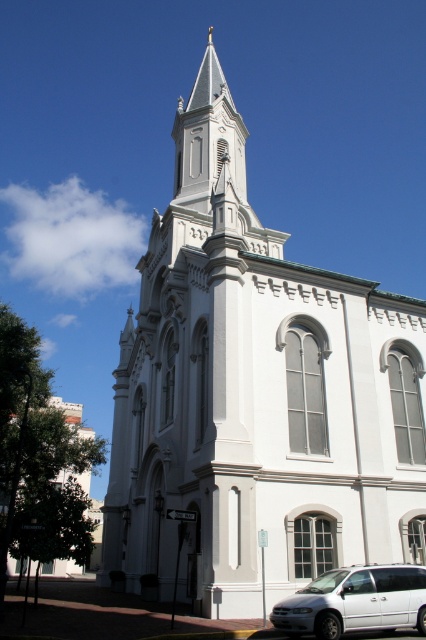
Is point (252, 488) behind point (365, 589)?

Yes.

The height and width of the screenshot is (640, 426). Describe the element at coordinates (256, 396) in the screenshot. I see `white stone church at center` at that location.

Measure the distance between point (x=210, y=380) and camera.

They are 137.27 feet apart.

What are the coordinates of `white stone church at center` in the screenshot? It's located at (256, 396).